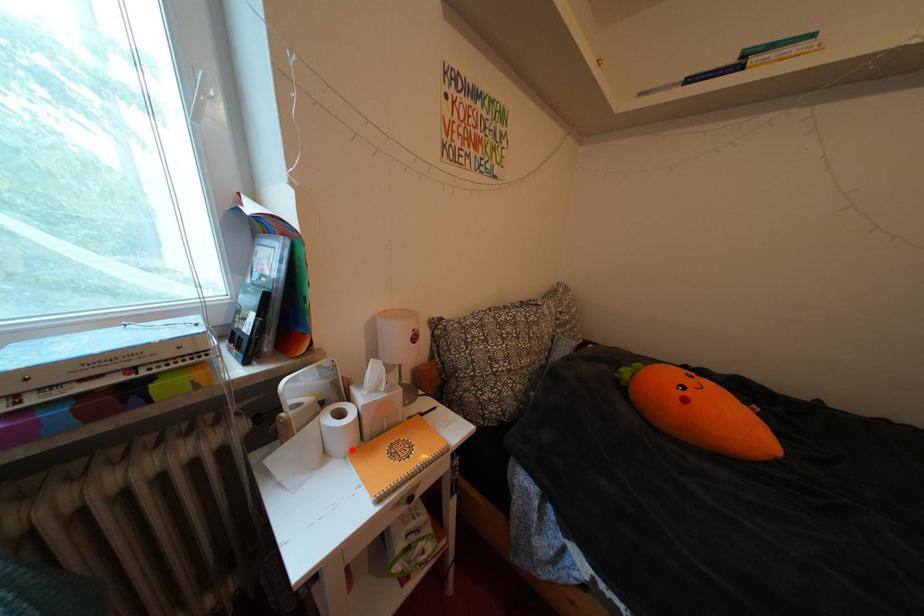
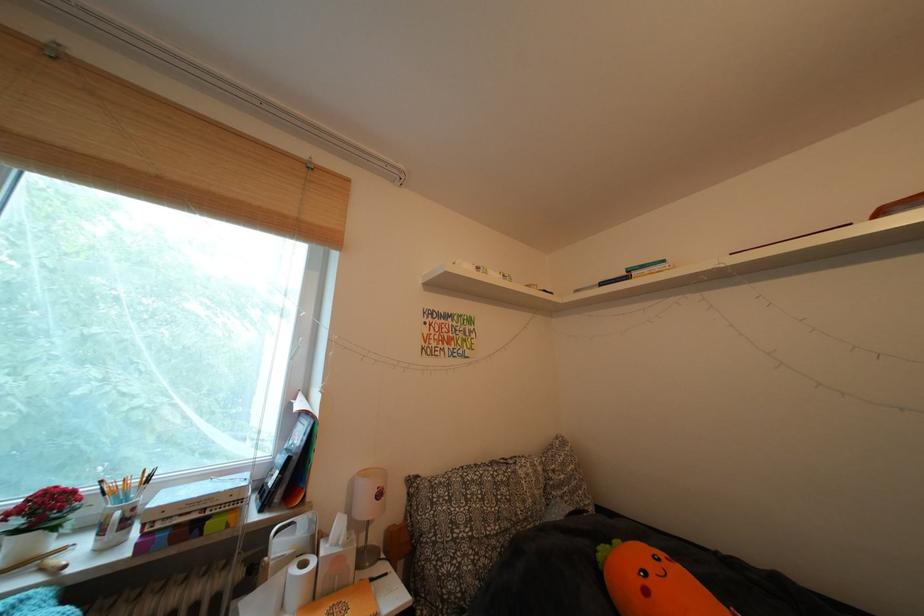
Locate, in the second image, the point that corresponds to the highlighted location in the first image.

(306, 602)